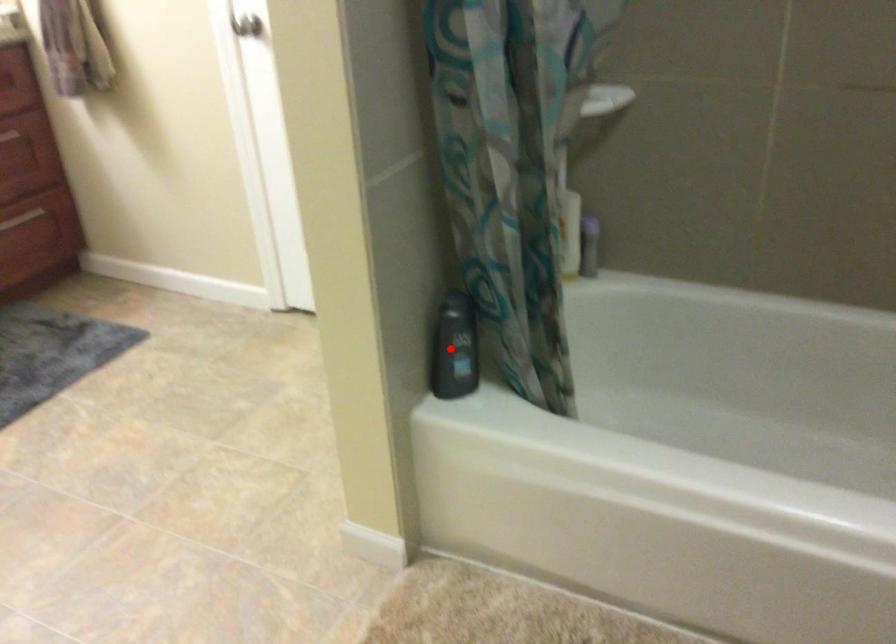
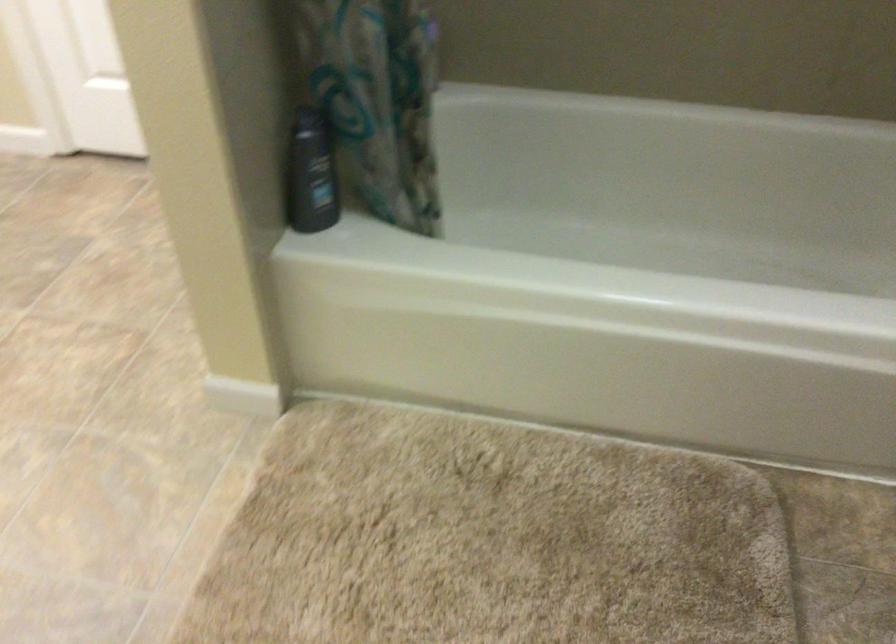
Question: I am providing you with two images of the same scene from different viewpoints. Given a red point in image1, look at the same physical point in image2. Is it:

Choices:
 (A) Closer to the viewpoint
 (B) Farther from the viewpoint

Answer: (A)